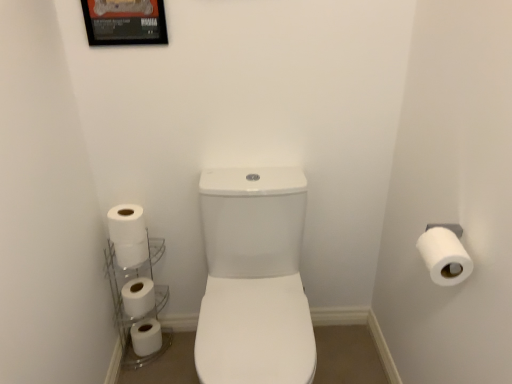
Question: Considering the positions of point (152, 327) and point (135, 13), is point (152, 327) closer or farther from the camera than point (135, 13)?

Choices:
 (A) farther
 (B) closer

Answer: (A)

Question: In the image, is white matte toilet paper at lower left, marked as the 5th toilet paper in a right-to-left arrangement, on the left side or the right side of metallic framed poster at upper left?

Choices:
 (A) left
 (B) right

Answer: (A)

Question: Considering the real-world distances, which object is closest to the white glossy toilet at center?

Choices:
 (A) clear glass shelves at lower left
 (B) white matte toilet paper at left, placed as the 5th toilet paper when sorted from bottom to top
 (C) metallic framed poster at upper left
 (D) white matte toilet paper at right, the first toilet paper when ordered from front to back
 (E) white matte toilet paper at lower left, the 4th toilet paper in the front-to-back sequence

Answer: (B)

Question: Which of these objects is positioned farthest from the white matte toilet paper at lower left, the 4th toilet paper in the front-to-back sequence?

Choices:
 (A) white matte toilet paper at left, placed as the 5th toilet paper when sorted from bottom to top
 (B) white matte toilet paper at left, which is counted as the 3th toilet paper, starting from the back
 (C) metallic framed poster at upper left
 (D) white matte toilet paper at lower left, the fifth toilet paper viewed from the top
 (E) clear glass shelves at lower left

Answer: (C)